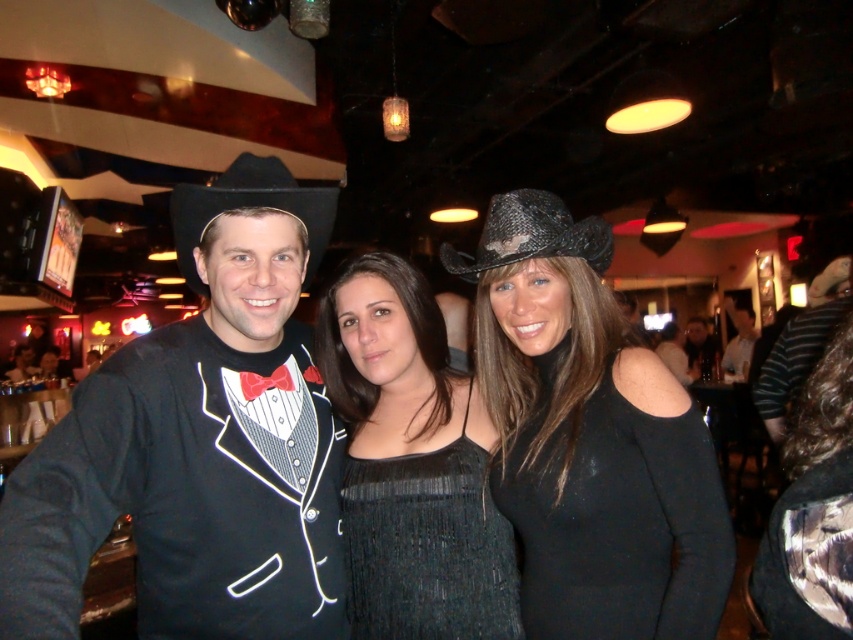
Question: Observing the image, what is the correct spatial positioning of matte black tuxedo at center in reference to black textured hat at center?

Choices:
 (A) above
 (B) below

Answer: (B)

Question: Among these points, which one is farthest from the camera?

Choices:
 (A) (294, 211)
 (B) (784, 349)
 (C) (827, 580)

Answer: (B)

Question: Which point is closer to the camera?

Choices:
 (A) black textured scarf at center
 (B) black felt fedora at left

Answer: (A)

Question: Which of the following is the closest to the observer?

Choices:
 (A) (444, 410)
 (B) (824, 291)

Answer: (A)

Question: Can you confirm if shiny black hat at center is positioned to the left of black felt fedora at left?

Choices:
 (A) yes
 (B) no

Answer: (B)

Question: Does shiny black hat at center appear under black textured scarf at center?

Choices:
 (A) no
 (B) yes

Answer: (A)